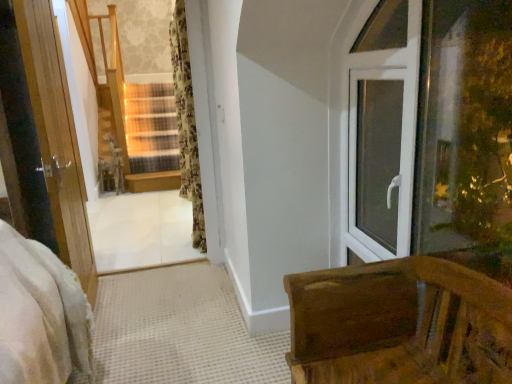
Question: Does floral fabric curtain at center have a larger size compared to wooden bench at lower right?

Choices:
 (A) yes
 (B) no

Answer: (B)

Question: Is floral fabric curtain at center oriented towards wooden bench at lower right?

Choices:
 (A) no
 (B) yes

Answer: (A)

Question: Does floral fabric curtain at center touch wooden bench at lower right?

Choices:
 (A) yes
 (B) no

Answer: (B)

Question: Is floral fabric curtain at center positioned before wooden bench at lower right?

Choices:
 (A) yes
 (B) no

Answer: (B)

Question: Considering the relative sizes of floral fabric curtain at center and wooden bench at lower right in the image provided, is floral fabric curtain at center wider than wooden bench at lower right?

Choices:
 (A) no
 (B) yes

Answer: (A)

Question: Is wooden bench at lower right completely or partially inside floral fabric curtain at center?

Choices:
 (A) no
 (B) yes

Answer: (A)

Question: Considering the relative sizes of white plastic window at right and wooden bench at lower right in the image provided, is white plastic window at right bigger than wooden bench at lower right?

Choices:
 (A) no
 (B) yes

Answer: (A)

Question: Is white plastic window at right positioned far away from wooden bench at lower right?

Choices:
 (A) no
 (B) yes

Answer: (A)

Question: From a real-world perspective, is white plastic window at right physically above wooden bench at lower right?

Choices:
 (A) yes
 (B) no

Answer: (A)

Question: Considering the relative positions of white plastic window at right and wooden bench at lower right in the image provided, is white plastic window at right to the right of wooden bench at lower right from the viewer's perspective?

Choices:
 (A) yes
 (B) no

Answer: (A)

Question: From the image's perspective, would you say white plastic window at right is shown under wooden bench at lower right?

Choices:
 (A) no
 (B) yes

Answer: (A)

Question: Is white plastic window at right directly adjacent to wooden bench at lower right?

Choices:
 (A) no
 (B) yes

Answer: (A)

Question: Does wooden at center turn towards wooden bench at lower right?

Choices:
 (A) no
 (B) yes

Answer: (B)